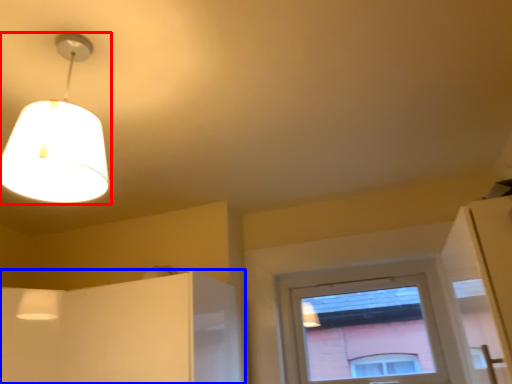
Question: Among these objects, which one is nearest to the camera, lamp (highlighted by a red box) or cabinetry (highlighted by a blue box)?

Choices:
 (A) lamp
 (B) cabinetry

Answer: (A)